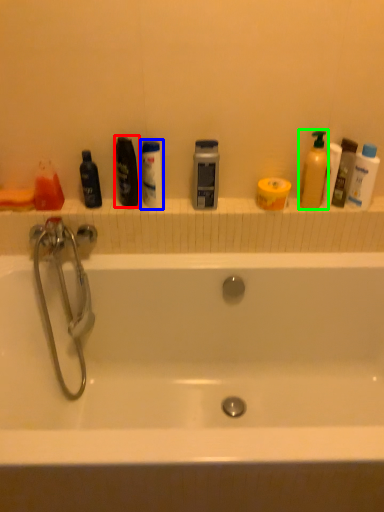
Question: Which object is the farthest from mouthwash (highlighted by a red box)? Choose among these: mouthwash (highlighted by a blue box) or cleaning product (highlighted by a green box).

Choices:
 (A) mouthwash
 (B) cleaning product

Answer: (B)